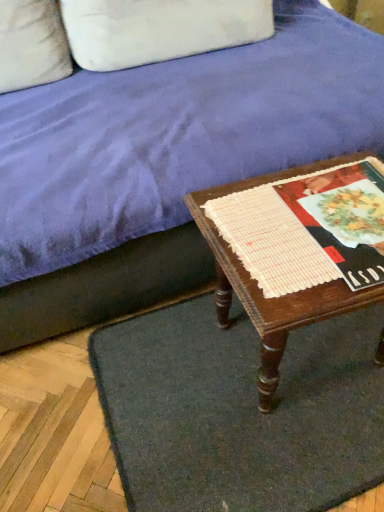
What is the approximate height of wooden table at lower right?

wooden table at lower right is 43.88 centimeters in height.

Measure the distance between velvet purple couch at upper center and camera.

They are 33.15 inches apart.

Where is `dark gray carpet at lower center`? This screenshot has width=384, height=512. dark gray carpet at lower center is located at coordinates (240, 411).

Locate an element on the screen. This screenshot has width=384, height=512. white woven placemat at center is located at coordinates [270, 241].

Is dark gray carpet at lower center smaller than white fabric pillow at upper left?

Correct, dark gray carpet at lower center occupies less space than white fabric pillow at upper left.

From a real-world perspective, which is physically above, dark gray carpet at lower center or white fabric pillow at upper left?

white fabric pillow at upper left.

Considering the sizes of dark gray carpet at lower center and white fabric pillow at upper left in the image, is dark gray carpet at lower center taller or shorter than white fabric pillow at upper left?

In the image, dark gray carpet at lower center appears to be shorter than white fabric pillow at upper left.

Image resolution: width=384 pixels, height=512 pixels. Find the location of `pillow positioned vertically above the dark gray carpet at lower center (from a real-world perspective)`. pillow positioned vertically above the dark gray carpet at lower center (from a real-world perspective) is located at coordinates (159, 29).

From a real-world perspective, who is located higher, velvet purple couch at upper center or white woven placemat at center?

From a 3D spatial view, white woven placemat at center is above.

Does point (341, 113) appear closer or farther from the camera than point (310, 253)?

Point (341, 113).

Who is shorter, velvet purple couch at upper center or white woven placemat at center?

Standing shorter between the two is white woven placemat at center.

Considering the positions of objects velvet purple couch at upper center and white woven placemat at center in the image provided, who is behind, velvet purple couch at upper center or white woven placemat at center?

white woven placemat at center is more distant.

Does white fabric pillow at upper left have a larger size compared to velvet purple couch at upper center?

Actually, white fabric pillow at upper left might be smaller than velvet purple couch at upper center.

Does point (233, 17) come closer to viewer compared to point (330, 120)?

No, (233, 17) is behind (330, 120).

Are white fabric pillow at upper left and velvet purple couch at upper center making contact?

white fabric pillow at upper left is not next to velvet purple couch at upper center, and they're not touching.

How distant is white fabric pillow at upper left from velvet purple couch at upper center?

white fabric pillow at upper left is 31.31 centimeters away from velvet purple couch at upper center.

From a real-world perspective, is wooden table at lower right beneath white fabric pillow at upper left?

Yes, from a real-world perspective, wooden table at lower right is beneath white fabric pillow at upper left.

From the image's perspective, is wooden table at lower right positioned above or below white fabric pillow at upper left?

Clearly, from the image's perspective, wooden table at lower right is below white fabric pillow at upper left.

Which is more to the left, wooden table at lower right or white fabric pillow at upper left?

white fabric pillow at upper left.

Is point (237, 241) closer to viewer compared to point (226, 309)?

Yes.

From a real-world perspective, which is physically above, white woven placemat at center or wooden table at lower right?

In real-world perspective, white woven placemat at center is above.

How different are the orientations of white woven placemat at center and wooden table at lower right in degrees?

white woven placemat at center and wooden table at lower right are facing 0.000308 degrees away from each other.

Is dark gray carpet at lower center wider or thinner than velvet purple couch at upper center?

Considering their sizes, dark gray carpet at lower center looks slimmer than velvet purple couch at upper center.

From the image's perspective, is dark gray carpet at lower center above or below velvet purple couch at upper center?

Based on their image positions, dark gray carpet at lower center is located beneath velvet purple couch at upper center.

Is there a large distance between dark gray carpet at lower center and velvet purple couch at upper center?

No, dark gray carpet at lower center is not far away from velvet purple couch at upper center.

Measure the distance from dark gray carpet at lower center to velvet purple couch at upper center.

dark gray carpet at lower center and velvet purple couch at upper center are 15.47 inches apart from each other.

Considering the relative sizes of wooden table at lower right and white woven placemat at center in the image provided, is wooden table at lower right shorter than white woven placemat at center?

In fact, wooden table at lower right may be taller than white woven placemat at center.

From the image's perspective, is wooden table at lower right on white woven placemat at center?

Incorrect, from the image's perspective, wooden table at lower right is lower than white woven placemat at center.

Would you say wooden table at lower right is inside or outside white woven placemat at center?

wooden table at lower right is not inside white woven placemat at center, it's outside.

Which is more to the right, wooden table at lower right or white woven placemat at center?

Positioned to the right is wooden table at lower right.

Where is `doormat in front of the white fabric pillow at upper left`? doormat in front of the white fabric pillow at upper left is located at coordinates (240, 411).

Where is `studio couch above the white woven placemat at center (from the image's perspective)`? The image size is (384, 512). studio couch above the white woven placemat at center (from the image's perspective) is located at coordinates point(164,163).

Based on their spatial positions, is velvet purple couch at upper center or dark gray carpet at lower center closer to wooden table at lower right?

The object closer to wooden table at lower right is dark gray carpet at lower center.

From the image, which object appears to be nearer to wooden table at lower right, velvet purple couch at upper center or white woven placemat at center?

Based on the image, white woven placemat at center appears to be nearer to wooden table at lower right.

Based on their spatial positions, is dark gray carpet at lower center or white woven placemat at center closer to white fabric pillow at upper left?

white woven placemat at center is positioned closer to the anchor white fabric pillow at upper left.

In the scene shown: Which object lies nearer to the anchor point dark gray carpet at lower center, wooden table at lower right or white woven placemat at center?

Based on the image, wooden table at lower right appears to be nearer to dark gray carpet at lower center.

Estimate the real-world distances between objects in this image. Which object is closer to wooden table at lower right, dark gray carpet at lower center or white woven placemat at center?

white woven placemat at center lies closer to wooden table at lower right than the other object.

When comparing their distances from velvet purple couch at upper center, does wooden table at lower right or white fabric pillow at upper left seem closer?

Based on the image, wooden table at lower right appears to be nearer to velvet purple couch at upper center.

Considering their positions, is dark gray carpet at lower center positioned closer to white woven placemat at center than wooden table at lower right?

Among the two, wooden table at lower right is located nearer to white woven placemat at center.

Based on their spatial positions, is white fabric pillow at upper left or velvet purple couch at upper center closer to wooden table at lower right?

Based on the image, velvet purple couch at upper center appears to be nearer to wooden table at lower right.

You are a GUI agent. You are given a task and a screenshot of the screen. Output one action in this format:
    pyautogui.click(x=<x>, y=<y>)
    Task: Click on the studio couch between white fabric pillow at upper left and dark gray carpet at lower center vertically
    
    Given the screenshot: What is the action you would take?
    pyautogui.click(x=164, y=163)

Where is `table that lies between velvet purple couch at upper center and dark gray carpet at lower center from top to bottom`? The width and height of the screenshot is (384, 512). table that lies between velvet purple couch at upper center and dark gray carpet at lower center from top to bottom is located at coordinates (275, 298).

Where is `studio couch between white fabric pillow at upper left and white woven placemat at center vertically`? studio couch between white fabric pillow at upper left and white woven placemat at center vertically is located at coordinates (164, 163).

Find the location of a particular element. This screenshot has width=384, height=512. linen between white fabric pillow at upper left and wooden table at lower right in the up-down direction is located at coordinates (270, 241).